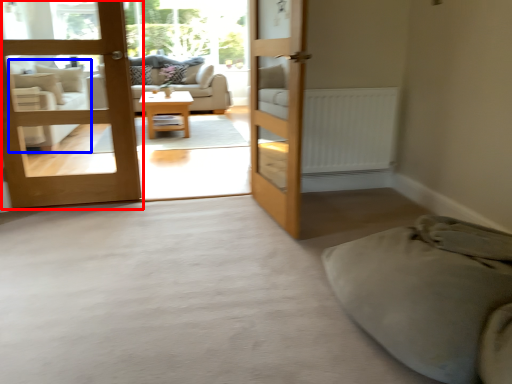
Question: Among these objects, which one is nearest to the camera, door (highlighted by a red box) or armchair (highlighted by a blue box)?

Choices:
 (A) door
 (B) armchair

Answer: (A)